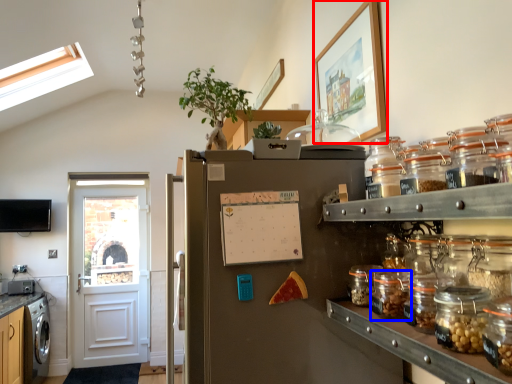
Question: Which object appears farthest to the camera in this image, picture frame (highlighted by a red box) or glass jar (highlighted by a blue box)?

Choices:
 (A) picture frame
 (B) glass jar

Answer: (A)